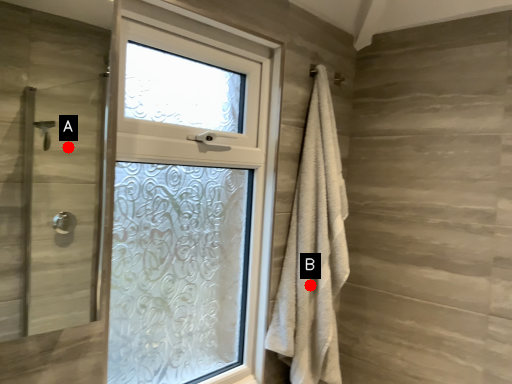
Question: Two points are circled on the image, labeled by A and B beside each circle. Which point is farther from the camera taking this photo?

Choices:
 (A) A is further
 (B) B is further

Answer: (A)